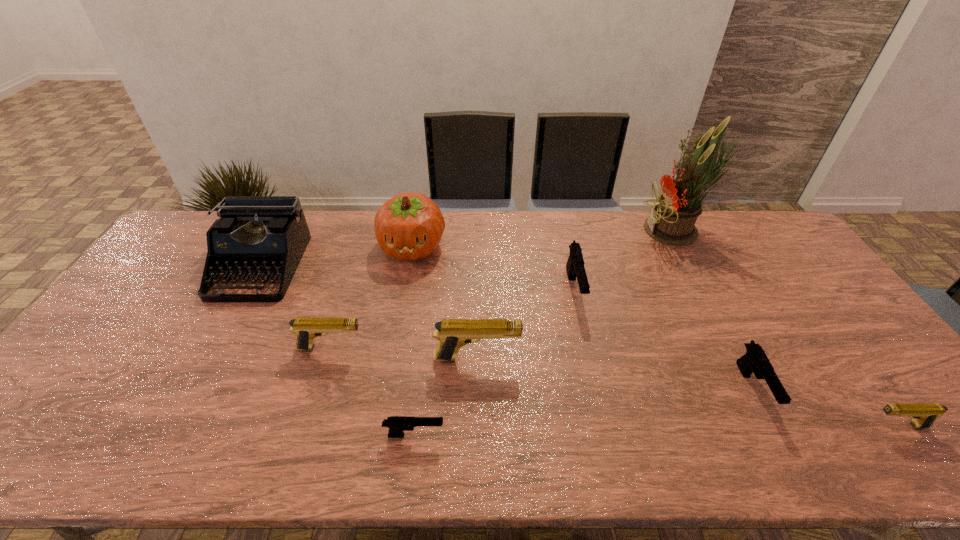
Where is `pumpkin at the far edge`? pumpkin at the far edge is located at coordinates (409, 226).

Image resolution: width=960 pixels, height=540 pixels. I want to click on typewriter at the far edge, so click(260, 235).

Identify the location of object that is at the right edge. (924, 415).

The width and height of the screenshot is (960, 540). Identify the location of object present at the near right corner. tap(924, 415).

Locate an element on the screen. The width and height of the screenshot is (960, 540). free space at the far edge of the desktop is located at coordinates (663, 248).

In the image, there is a desktop. In order to click on vacant space at the near edge in this screenshot , I will do coord(571,464).

In the image, there is a desktop. At what (x,y) coordinates should I click in order to perform the action: click on vacant space at the left edge. Please return your answer as a coordinate pair (x, y). This screenshot has height=540, width=960. Looking at the image, I should click on (116, 345).

Locate an element on the screen. The height and width of the screenshot is (540, 960). free region at the right edge is located at coordinates (833, 341).

Image resolution: width=960 pixels, height=540 pixels. Find the location of `vacant point located between the typewriter and the green pumpkin`. vacant point located between the typewriter and the green pumpkin is located at coordinates (335, 256).

In order to click on vacant space that's between the typewriter and the second farthest tan pistol in this screenshot , I will do `click(368, 312)`.